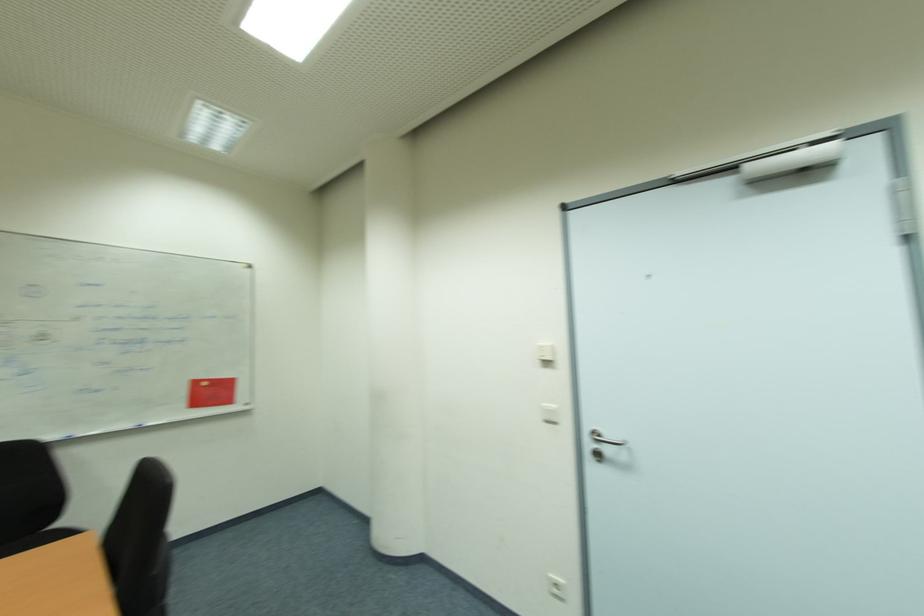
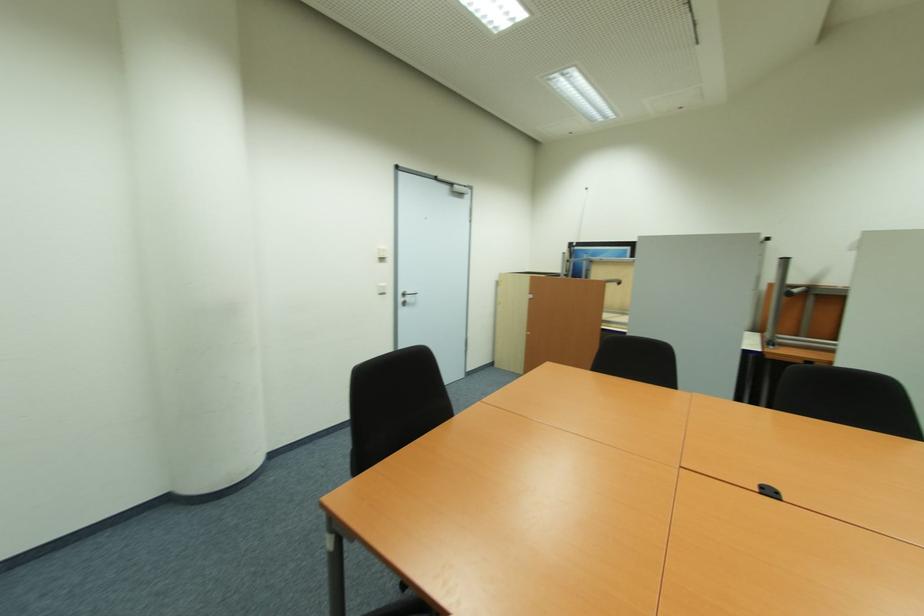
Find the pixel in the second image that matches (x=551, y=363) in the first image.

(385, 260)